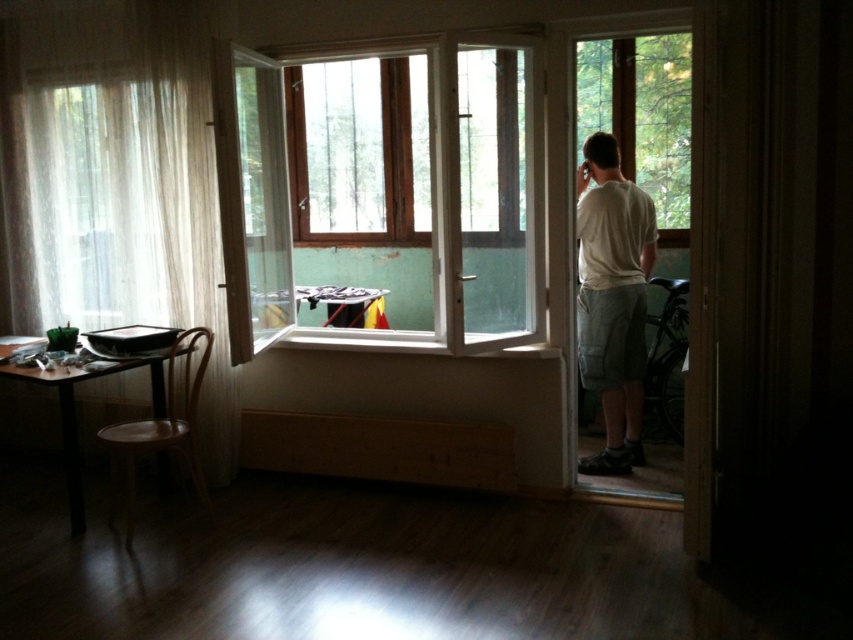
Is wooden frame at center positioned before white cotton shirt at right?

That is True.

Which is more to the right, wooden frame at center or white cotton shirt at right?

From the viewer's perspective, white cotton shirt at right appears more on the right side.

Does point (390, 264) come closer to viewer compared to point (589, 307)?

No, it is not.

You are a GUI agent. You are given a task and a screenshot of the screen. Output one action in this format:
    pyautogui.click(x=<x>, y=<y>)
    Task: Click on the wooden frame at center
    This screenshot has height=640, width=853.
    Given the screenshot: What is the action you would take?
    pyautogui.click(x=383, y=195)

Who is positioned more to the right, wooden frame at center or white sheer curtain at left?

Positioned to the right is wooden frame at center.

Is wooden frame at center shorter than white sheer curtain at left?

Correct, wooden frame at center is not as tall as white sheer curtain at left.

Identify the location of wooden frame at center. (383, 195).

Is transparent glass door at center below white cotton shirt at right?

Incorrect, transparent glass door at center is not positioned below white cotton shirt at right.

Between point (526, 214) and point (625, 442), which one is positioned in front?

Point (526, 214) is in front.

Locate an element on the screen. transparent glass door at center is located at coordinates click(496, 196).